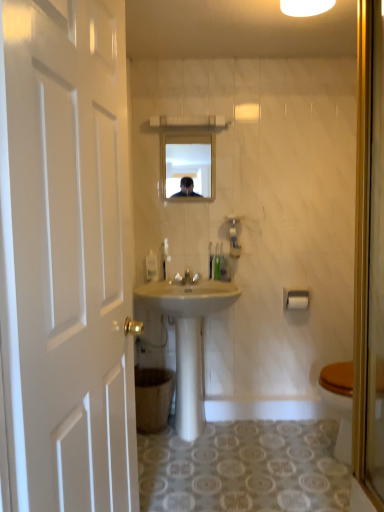
Question: From the image's perspective, is white plastic towel bar at upper right positioned above or below white glossy faucet at center?

Choices:
 (A) above
 (B) below

Answer: (B)

Question: Considering the positions of white plastic towel bar at upper right and white glossy faucet at center in the image, is white plastic towel bar at upper right wider or thinner than white glossy faucet at center?

Choices:
 (A) thin
 (B) wide

Answer: (A)

Question: Which object is positioned closest to the white glossy faucet at center?

Choices:
 (A) matte glass mirror at upper center
 (B) brown cardboard trash bin/can at lower left
 (C) white plastic towel bar at upper right
 (D) white glossy light fixture at upper center
 (E) white wooden door at left

Answer: (C)

Question: Estimate the real-world distances between objects in this image. Which object is farther from the brown cardboard trash bin/can at lower left?

Choices:
 (A) white glossy light fixture at upper center
 (B) translucent plastic soap dispenser at center, the 1th toiletries when ordered from right to left
 (C) matte glass mirror at upper center
 (D) green plastic toothbrushes at center, the 2th toiletries from the left
 (E) white glossy faucet at center

Answer: (A)